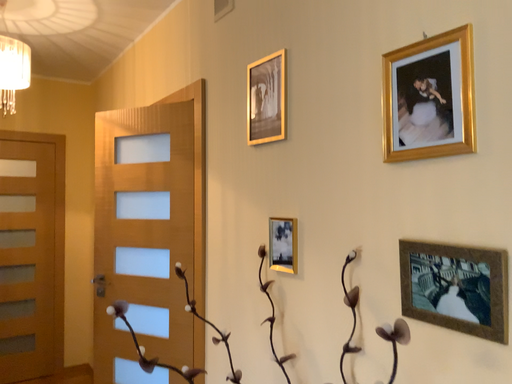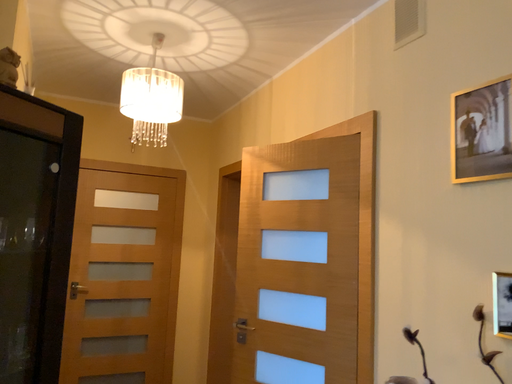
Question: Which way did the camera rotate in the video?

Choices:
 (A) rotated right
 (B) rotated left

Answer: (B)